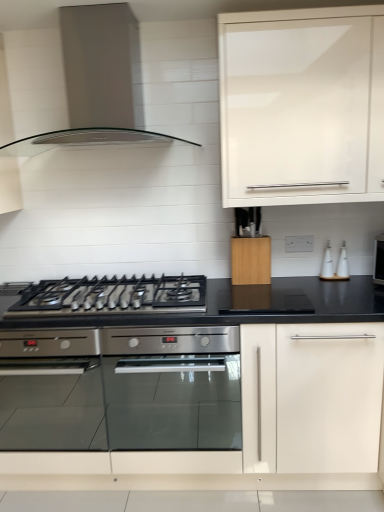
Question: From the image's perspective, is white glossy bottle at right located above or below white glossy cabinet at upper right, marked as the first cabinetry in a top-to-bottom arrangement?

Choices:
 (A) above
 (B) below

Answer: (B)

Question: Is point (329, 271) positioned closer to the camera than point (299, 105)?

Choices:
 (A) closer
 (B) farther

Answer: (B)

Question: Estimate the real-world distances between objects in this image. Which object is closer to the white glossy soap dispenser at right?

Choices:
 (A) white glossy bottle at right
 (B) wooden knife block at center, placed as the 1th cabinetry when sorted from bottom to top
 (C) white glossy cabinet at upper right, the second cabinetry from the bottom
 (D) black matte gas stove at center
 (E) satin metallic range hood at upper center

Answer: (A)

Question: Which of these objects is positioned closest to the satin metallic range hood at upper center?

Choices:
 (A) stainless steel oven at center
 (B) white glossy soap dispenser at right
 (C) white glossy bottle at right
 (D) wooden knife block at center, placed as the 1th cabinetry when sorted from bottom to top
 (E) white glossy cabinet at upper right, marked as the first cabinetry in a top-to-bottom arrangement

Answer: (E)